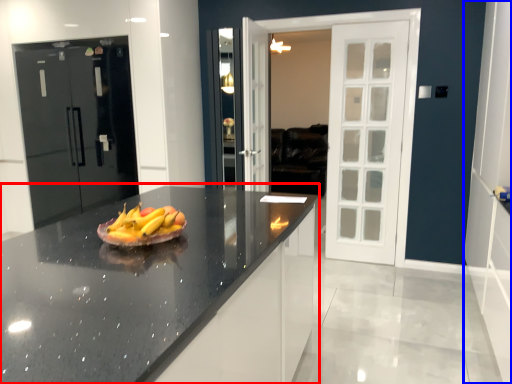
Question: Among these objects, which one is farthest to the camera, countertop (highlighted by a red box) or side (highlighted by a blue box)?

Choices:
 (A) countertop
 (B) side

Answer: (B)